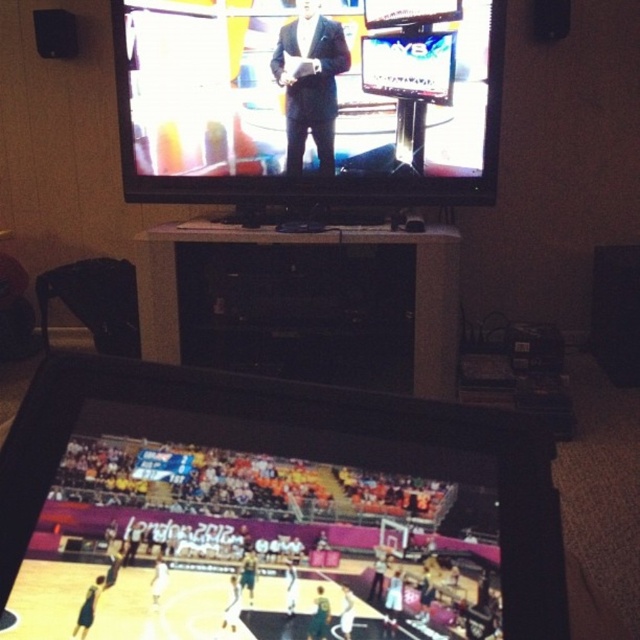
How far apart are black glossy tablet at lower center and matte black suit at center?

A distance of 7.43 feet exists between black glossy tablet at lower center and matte black suit at center.

Is point (538, 442) farther from viewer compared to point (282, 45)?

No, it is not.

I want to click on black glossy tablet at lower center, so click(x=296, y=452).

Who is shorter, black glossy tablet at lower center or black glossy entertainment center at center?

With less height is black glossy tablet at lower center.

Is point (333, 401) behind point (422, 284)?

No, (333, 401) is closer to viewer.

I want to click on black glossy tablet at lower center, so tap(296, 452).

Is black glossy tv at upper center above matte black suit at center?

Incorrect, black glossy tv at upper center is not positioned above matte black suit at center.

Is point (212, 97) positioned after point (332, 132)?

Yes.

Does point (282, 84) come in front of point (292, 88)?

No.

Identify the location of black glossy tv at upper center. (300, 106).